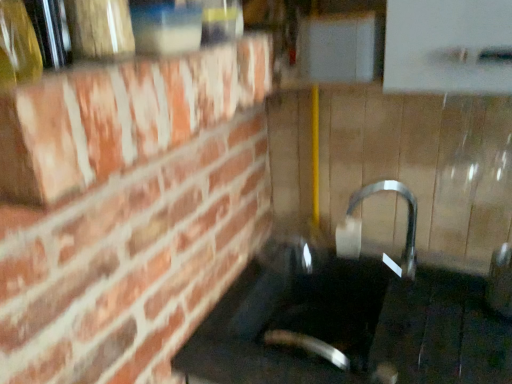
Question: Is satin nickel faucet at center inside translucent glass bottle at upper left?

Choices:
 (A) no
 (B) yes

Answer: (A)

Question: Are translucent glass bottle at upper left and satin nickel faucet at center located far from each other?

Choices:
 (A) yes
 (B) no

Answer: (B)

Question: Does translucent glass bottle at upper left have a lesser height compared to satin nickel faucet at center?

Choices:
 (A) yes
 (B) no

Answer: (A)

Question: Is translucent glass bottle at upper left at the right side of satin nickel faucet at center?

Choices:
 (A) no
 (B) yes

Answer: (A)

Question: From a real-world perspective, is translucent glass bottle at upper left located beneath satin nickel faucet at center?

Choices:
 (A) no
 (B) yes

Answer: (A)

Question: In terms of width, does satin nickel faucet at center look wider or thinner when compared to black glass sink at center?

Choices:
 (A) thin
 (B) wide

Answer: (A)

Question: Is satin nickel faucet at center spatially inside black glass sink at center, or outside of it?

Choices:
 (A) inside
 (B) outside

Answer: (B)

Question: Looking at the image, does satin nickel faucet at center seem bigger or smaller compared to black glass sink at center?

Choices:
 (A) big
 (B) small

Answer: (B)

Question: From the image's perspective, is satin nickel faucet at center located above or below black glass sink at center?

Choices:
 (A) below
 (B) above

Answer: (B)

Question: Does point (353, 231) appear closer or farther from the camera than point (31, 51)?

Choices:
 (A) farther
 (B) closer

Answer: (A)

Question: From a real-world perspective, is satin nickel faucet at center above or below translucent glass bottle at upper left?

Choices:
 (A) above
 (B) below

Answer: (B)

Question: Is satin nickel faucet at center situated inside translucent glass bottle at upper left or outside?

Choices:
 (A) inside
 (B) outside

Answer: (B)

Question: Looking at their shapes, would you say satin nickel faucet at center is wider or thinner than translucent glass bottle at upper left?

Choices:
 (A) wide
 (B) thin

Answer: (A)

Question: In the image, is translucent glass bottle at upper left positioned in front of or behind satin nickel faucet at center?

Choices:
 (A) behind
 (B) front

Answer: (B)

Question: From their relative heights in the image, would you say translucent glass bottle at upper left is taller or shorter than satin nickel faucet at center?

Choices:
 (A) short
 (B) tall

Answer: (A)